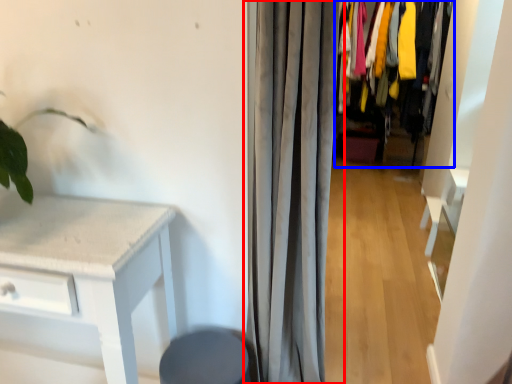
Question: Which object appears closest to the camera in this image, curtain (highlighted by a red box) or closet (highlighted by a blue box)?

Choices:
 (A) curtain
 (B) closet

Answer: (A)